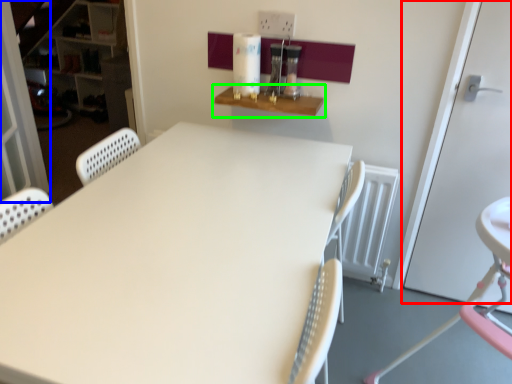
Question: Estimate the real-world distances between objects in this image. Which object is closer to door (highlighted by a red box), screen door (highlighted by a blue box) or shelf (highlighted by a green box)?

Choices:
 (A) screen door
 (B) shelf

Answer: (B)